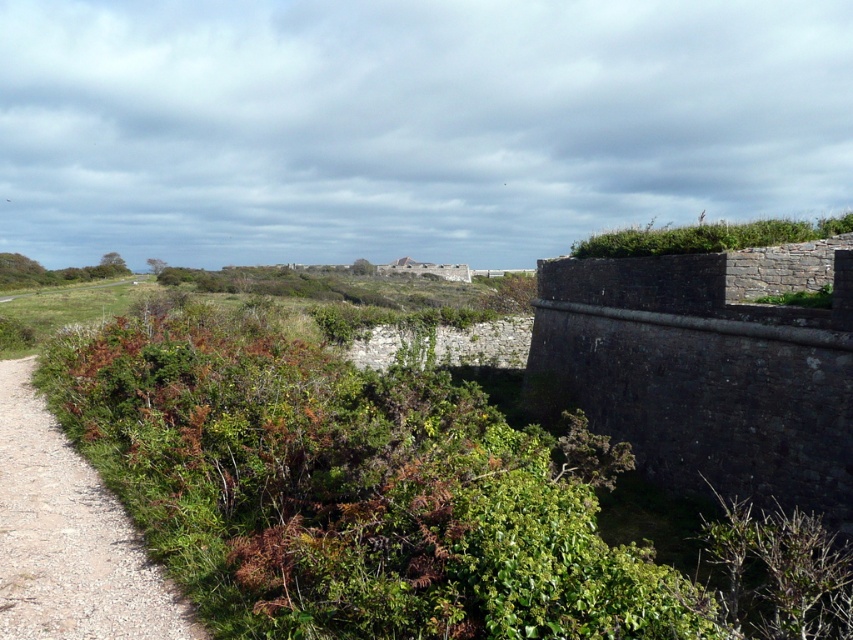
You are a hiker trying to decide which path to take next. You see the green leafy trail at left and the green leafy shrub at upper right. Which one is taller?

The green leafy shrub at upper right is taller than the green leafy trail at left.

You are planning to paint a mural on the largest object in the scene. Which object should you choose between the dark gray stone wall at right and the green leafy shrub at upper right?

The dark gray stone wall at right is wider than the green leafy shrub at upper right, so you should choose the dark gray stone wall at right for the mural.

Looking at this image, you are a hiker trying to decide which path to take next. You see the green leafy trail at left and the green leafy shrub at upper right. Which of these two has a narrower width?

The green leafy trail at left is thinner than the green leafy shrub at upper right, so the green leafy trail at left has a narrower width.